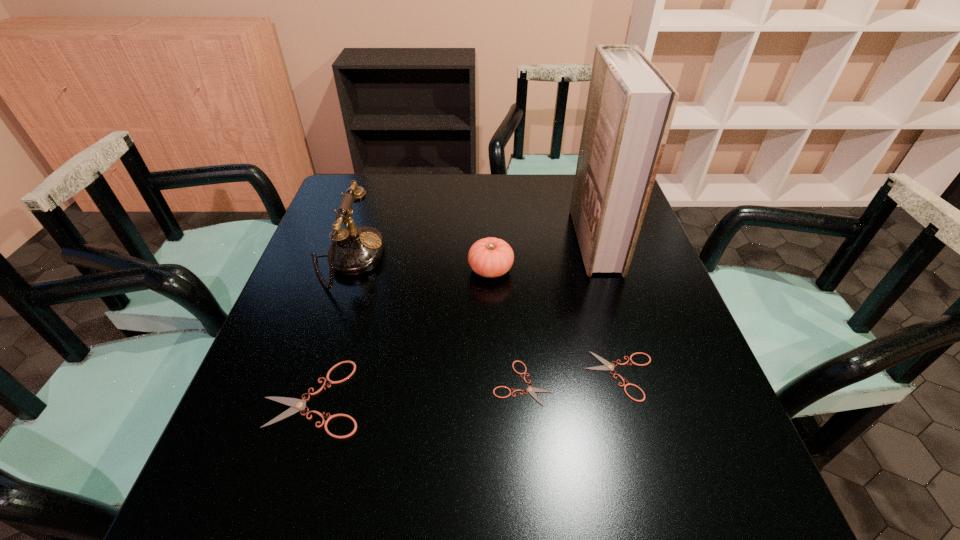
Locate an element on the screen. vacant space located on the left of the second shears from right to left is located at coordinates (369, 383).

At what (x,y) coordinates should I click in order to perform the action: click on free region located on the back of the second tallest shears. Please return your answer as a coordinate pair (x, y). This screenshot has height=540, width=960. Looking at the image, I should click on (586, 248).

Identify the location of vacant region located on the cover of the tallest object. The image size is (960, 540). click(x=461, y=240).

Identify the location of free space located on the cover of the tallest object. The image size is (960, 540). (465, 240).

What are the coordinates of `vacant space located 0.260m on the cover of the tallest object` in the screenshot? It's located at (483, 240).

Find the location of a particular element. vacant point located 0.270m on the right of the tomato is located at coordinates (618, 269).

The image size is (960, 540). I want to click on vacant space located 0.320m on the dial of the telephone, so click(x=503, y=259).

Locate an element on the screen. The height and width of the screenshot is (540, 960). object that is at the far edge is located at coordinates (630, 107).

The width and height of the screenshot is (960, 540). In order to click on object that is at the near edge in this screenshot , I will do `click(297, 405)`.

Where is `shears that is positioned at the left edge`? The image size is (960, 540). shears that is positioned at the left edge is located at coordinates (297, 405).